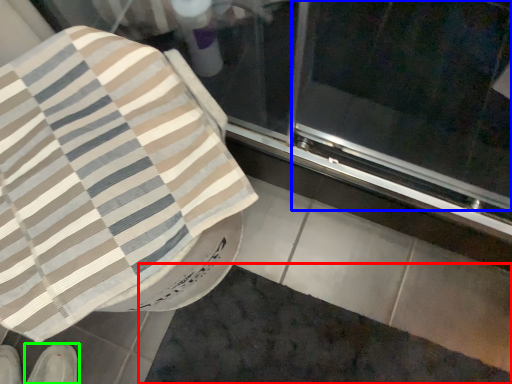
Question: Based on their relative distances, which object is farther from bath mat (highlighted by a red box)? Choose from screen door (highlighted by a blue box) and footwear (highlighted by a green box).

Choices:
 (A) screen door
 (B) footwear

Answer: (A)